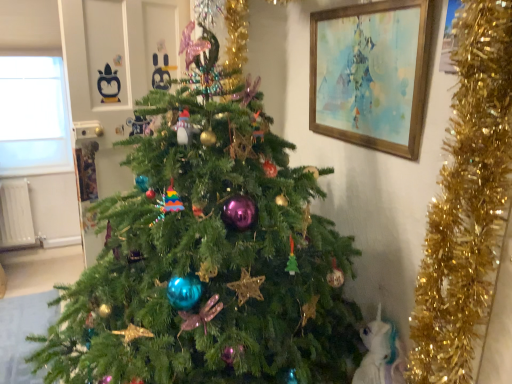
Where is `wooden framed painting at upper right`? wooden framed painting at upper right is located at coordinates (372, 74).

From the picture: What is the approximate width of green matte christmas tree at center?

green matte christmas tree at center is 1.35 meters wide.

Image resolution: width=512 pixels, height=384 pixels. What do you see at coordinates (33, 116) in the screenshot?
I see `transparent glass window at upper left` at bounding box center [33, 116].

What is the approximate width of transparent glass window at upper left?

The width of transparent glass window at upper left is 4.41 inches.

Locate an element on the screen. Image resolution: width=512 pixels, height=384 pixels. wooden framed painting at upper right is located at coordinates (372, 74).

From the picture: Can you see transparent glass window at upper left touching wooden framed painting at upper right?

No, transparent glass window at upper left is not next to wooden framed painting at upper right.

Is point (2, 172) farther from camera compared to point (374, 27)?

Yes, point (2, 172) is behind point (374, 27).

From a real-world perspective, relative to wooden framed painting at upper right, is transparent glass window at upper left vertically above or below?

transparent glass window at upper left is situated lower than wooden framed painting at upper right in the real world.

Can you confirm if transparent glass window at upper left is bigger than wooden framed painting at upper right?

Indeed, transparent glass window at upper left has a larger size compared to wooden framed painting at upper right.

Which is correct: green matte christmas tree at center is inside transparent glass window at upper left, or outside of it?

green matte christmas tree at center is spatially situated outside transparent glass window at upper left.

Considering the sizes of green matte christmas tree at center and transparent glass window at upper left in the image, is green matte christmas tree at center bigger or smaller than transparent glass window at upper left?

Considering their sizes, green matte christmas tree at center takes up more space than transparent glass window at upper left.

You are a GUI agent. You are given a task and a screenshot of the screen. Output one action in this format:
    pyautogui.click(x=<x>, y=<y>)
    Task: Click on the christmas tree on the right of transparent glass window at upper left
    The image size is (512, 384).
    Given the screenshot: What is the action you would take?
    pyautogui.click(x=209, y=253)

Is transparent glass window at upper left at the back of green matte christmas tree at center?

green matte christmas tree at center does not have its back to transparent glass window at upper left.

Which of these two, transparent glass window at upper left or green matte christmas tree at center, is wider?

green matte christmas tree at center.

Is transparent glass window at upper left next to green matte christmas tree at center?

No, transparent glass window at upper left is not touching green matte christmas tree at center.

From the image's perspective, which one is positioned higher, transparent glass window at upper left or green matte christmas tree at center?

transparent glass window at upper left.

Based on the photo, considering the relative sizes of white feathered bird at lower right and wooden framed painting at upper right in the image provided, is white feathered bird at lower right smaller than wooden framed painting at upper right?

Indeed, white feathered bird at lower right has a smaller size compared to wooden framed painting at upper right.

At what (x,y) coordinates should I click in order to perform the action: click on animal on the right side of wooden framed painting at upper right. Please return your answer as a coordinate pair (x, y). The image size is (512, 384). Looking at the image, I should click on (380, 354).

Considering the points (398, 351) and (369, 135), which point is in front, point (398, 351) or point (369, 135)?

Positioned in front is point (398, 351).

Considering the sizes of white feathered bird at lower right and wooden framed painting at upper right in the image, is white feathered bird at lower right wider or thinner than wooden framed painting at upper right?

Considering their sizes, white feathered bird at lower right looks broader than wooden framed painting at upper right.

Is wooden framed painting at upper right oriented away from transparent glass window at upper left?

wooden framed painting at upper right does not have its back to transparent glass window at upper left.

Does point (426, 3) come closer to viewer compared to point (14, 75)?

Yes, point (426, 3) is closer to viewer.

In the scene shown: From the image's perspective, is wooden framed painting at upper right positioned above or below transparent glass window at upper left?

Based on their image positions, wooden framed painting at upper right is located beneath transparent glass window at upper left.

Considering the relative sizes of wooden framed painting at upper right and transparent glass window at upper left in the image provided, is wooden framed painting at upper right thinner than transparent glass window at upper left?

Yes, wooden framed painting at upper right is thinner than transparent glass window at upper left.

Choose the correct answer: Is white feathered bird at lower right inside transparent glass window at upper left or outside it?

white feathered bird at lower right lies outside transparent glass window at upper left.

Considering the sizes of objects white feathered bird at lower right and transparent glass window at upper left in the image provided, who is smaller, white feathered bird at lower right or transparent glass window at upper left?

white feathered bird at lower right.

Where is `animal that is in front of the transparent glass window at upper left`? Image resolution: width=512 pixels, height=384 pixels. animal that is in front of the transparent glass window at upper left is located at coordinates (380, 354).

From the picture: Is wooden framed painting at upper right completely or partially inside green matte christmas tree at center?

No, wooden framed painting at upper right is not a part of green matte christmas tree at center.

From a real-world perspective, is green matte christmas tree at center positioned over wooden framed painting at upper right based on gravity?

No, from a real-world perspective, green matte christmas tree at center is not on top of wooden framed painting at upper right.

Does green matte christmas tree at center have a smaller size compared to wooden framed painting at upper right?

No.

Considering the positions of objects green matte christmas tree at center and wooden framed painting at upper right in the image provided, who is in front, green matte christmas tree at center or wooden framed painting at upper right?

green matte christmas tree at center is more forward.

Locate an element on the screen. This screenshot has width=512, height=384. picture frame on the right of the transparent glass window at upper left is located at coordinates point(372,74).

Where is `christmas tree located below the transparent glass window at upper left (from the image's perspective)`? This screenshot has height=384, width=512. christmas tree located below the transparent glass window at upper left (from the image's perspective) is located at coordinates coord(209,253).

Estimate the real-world distances between objects in this image. Which object is closer to white feathered bird at lower right, transparent glass window at upper left or green matte christmas tree at center?

Based on the image, green matte christmas tree at center appears to be nearer to white feathered bird at lower right.

From the image, which object appears to be nearer to wooden framed painting at upper right, green matte christmas tree at center or white feathered bird at lower right?

green matte christmas tree at center.

Which object lies nearer to the anchor point white feathered bird at lower right, green matte christmas tree at center or wooden framed painting at upper right?

green matte christmas tree at center is positioned closer to the anchor white feathered bird at lower right.

Based on their spatial positions, is transparent glass window at upper left or white feathered bird at lower right further from green matte christmas tree at center?

transparent glass window at upper left is positioned further to the anchor green matte christmas tree at center.

Which object lies further to the anchor point transparent glass window at upper left, wooden framed painting at upper right or green matte christmas tree at center?

wooden framed painting at upper right is further to transparent glass window at upper left.

Based on their spatial positions, is transparent glass window at upper left or green matte christmas tree at center closer to wooden framed painting at upper right?

green matte christmas tree at center is closer to wooden framed painting at upper right.

Which object lies nearer to the anchor point green matte christmas tree at center, white feathered bird at lower right or transparent glass window at upper left?

white feathered bird at lower right is closer to green matte christmas tree at center.

Estimate the real-world distances between objects in this image. Which object is closer to transparent glass window at upper left, white feathered bird at lower right or green matte christmas tree at center?

green matte christmas tree at center is positioned closer to the anchor transparent glass window at upper left.

The width and height of the screenshot is (512, 384). In order to click on picture frame between green matte christmas tree at center and transparent glass window at upper left along the z-axis in this screenshot , I will do `click(372, 74)`.

This screenshot has width=512, height=384. In order to click on christmas tree between wooden framed painting at upper right and white feathered bird at lower right from top to bottom in this screenshot , I will do `click(209, 253)`.

Where is `animal between green matte christmas tree at center and transparent glass window at upper left along the z-axis`? animal between green matte christmas tree at center and transparent glass window at upper left along the z-axis is located at coordinates (380, 354).

In order to click on picture frame between transparent glass window at upper left and white feathered bird at lower right in this screenshot , I will do `click(372, 74)`.